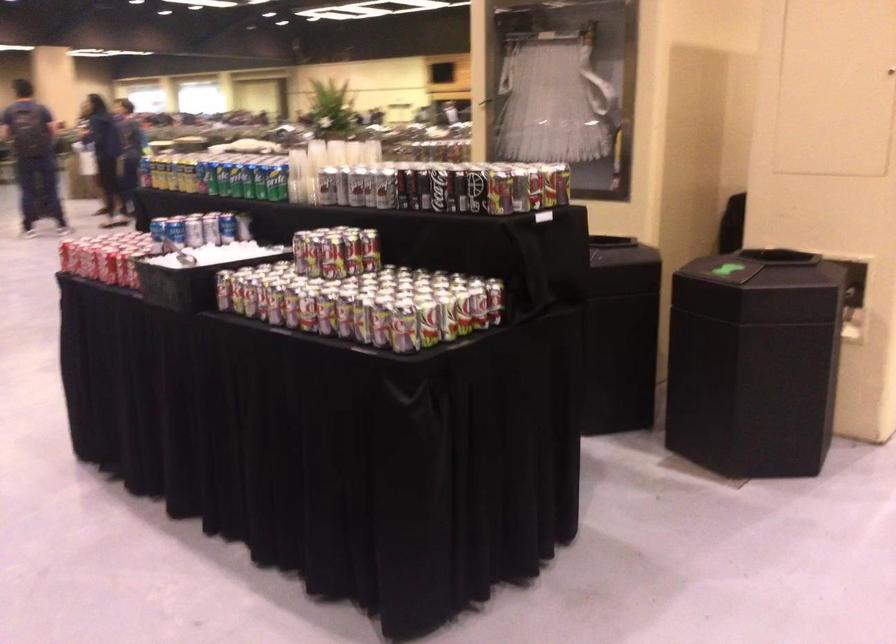
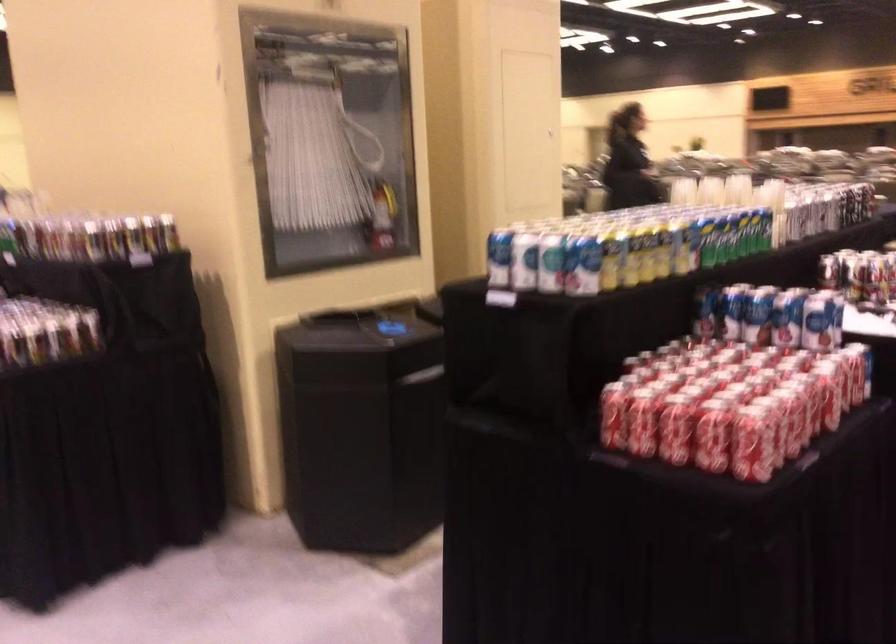
Where in the second image is the point corresponding to (597,143) from the first image?

(382, 216)